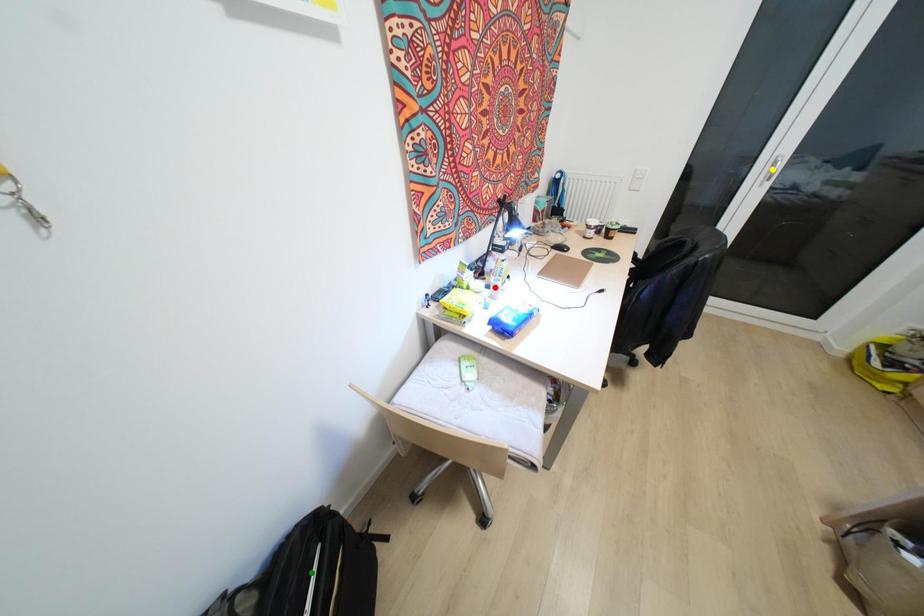
Order these from nearest to farthest:
A) green point
B) yellow point
C) red point

1. green point
2. red point
3. yellow point